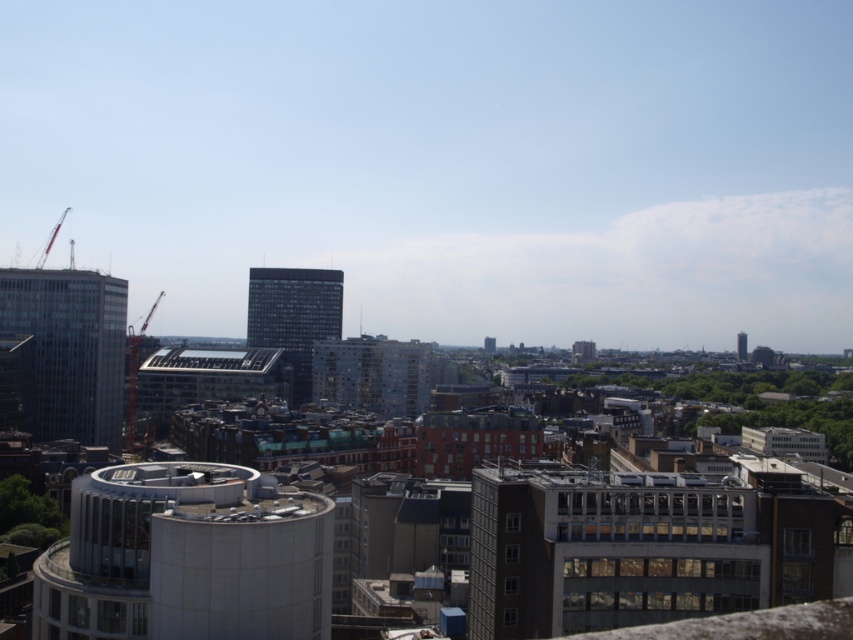
You are standing at the center of the city and see the point marked at coordinates (71, 348). What does this point indicate in the cityscape?

The point at coordinates (71, 348) indicates the location of the glassy reflective skyscraper at left.